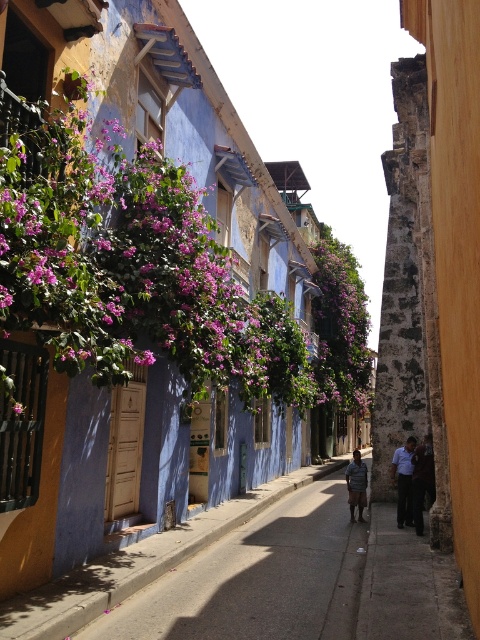
You are a photographer standing on the smooth concrete pavement at center. You want to take a photo of the striped fabric shirt at center. Which object is taller so that you can adjust your camera angle accordingly?

The smooth concrete pavement at center is much taller than the striped fabric shirt at center, so you should angle your camera upwards to capture the entire height of the pavement in the photo.